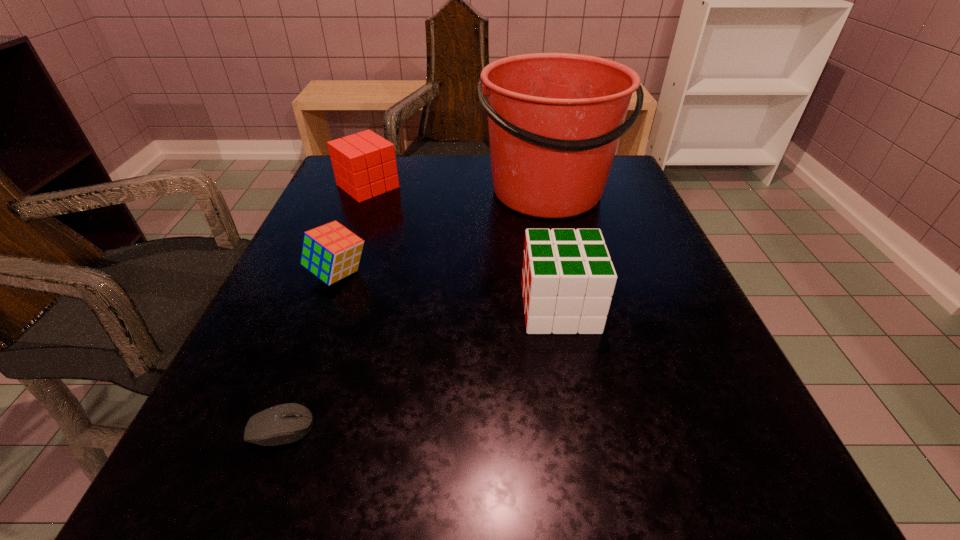
Image resolution: width=960 pixels, height=540 pixels. Find the location of `vacant position at the near edge of the desktop`. vacant position at the near edge of the desktop is located at coordinates (624, 453).

Locate an element on the screen. The height and width of the screenshot is (540, 960). vacant region at the left edge of the desktop is located at coordinates (287, 316).

You are a GUI agent. You are given a task and a screenshot of the screen. Output one action in this format:
    pyautogui.click(x=<x>, y=<y>)
    Task: Click on the vacant space at the right edge of the desktop
    
    Given the screenshot: What is the action you would take?
    pyautogui.click(x=645, y=358)

Locate an element on the screen. The image size is (960, 540). vacant area at the far left corner is located at coordinates pos(382,200).

This screenshot has width=960, height=540. In order to click on vacant space at the near left corner in this screenshot , I will do `click(192, 484)`.

Identify the location of free space at the far right corner of the desktop. (628, 205).

I want to click on free area in between the computer equipment and the rightmost cube, so click(420, 368).

Identify the location of free space between the computer equipment and the farthest cube. This screenshot has height=540, width=960. (324, 307).

The image size is (960, 540). Find the location of `free space between the shortest object and the bucket`. free space between the shortest object and the bucket is located at coordinates (415, 310).

At what (x,y) coordinates should I click in order to perform the action: click on vacant point located between the farthest cube and the nearest object. Please return your answer as a coordinate pair (x, y). This screenshot has width=960, height=540. Looking at the image, I should click on (324, 307).